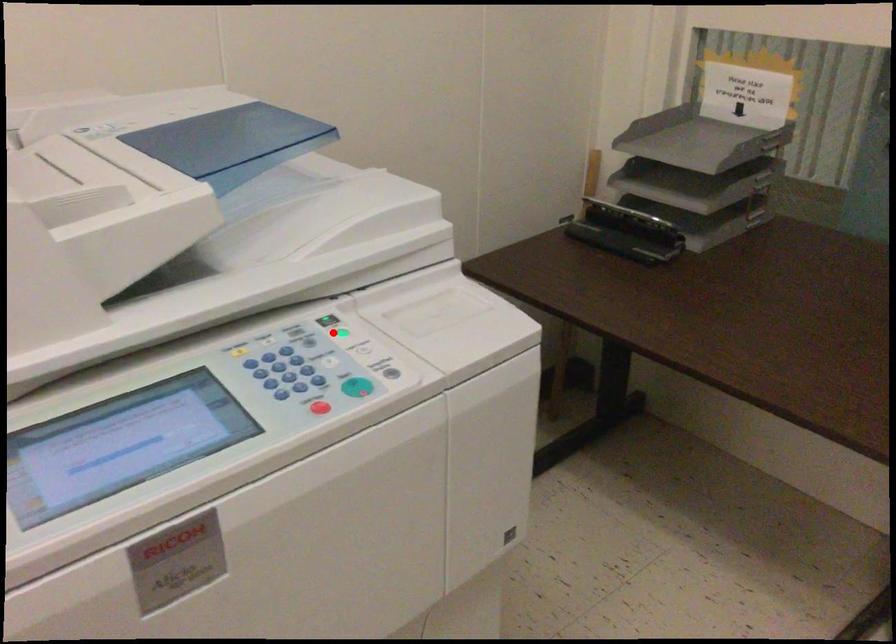
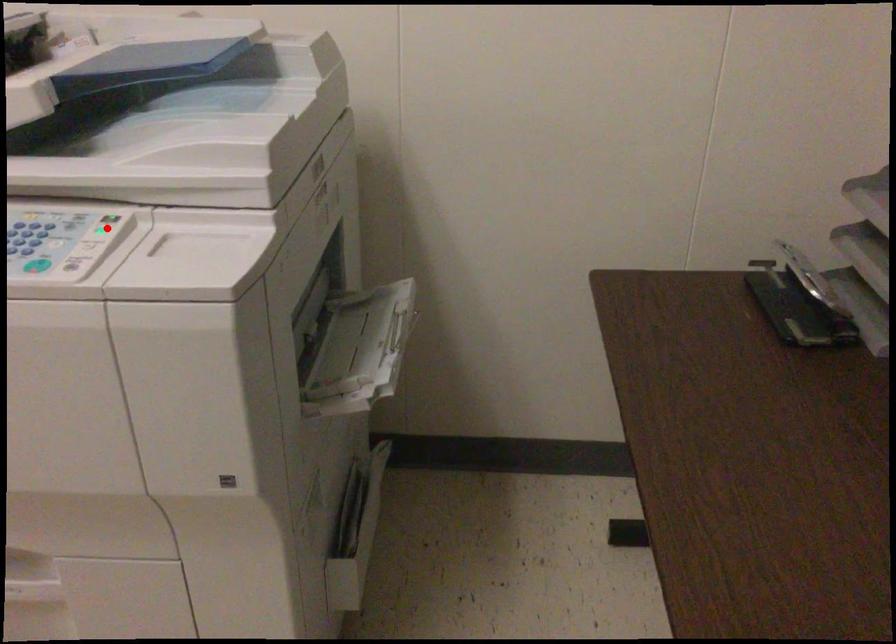
I am providing you with two images of the same scene from different viewpoints. A red point is marked on the first image and another point is marked on the second image. Is the red point in image1 aligned with the point shown in image2?

Yes